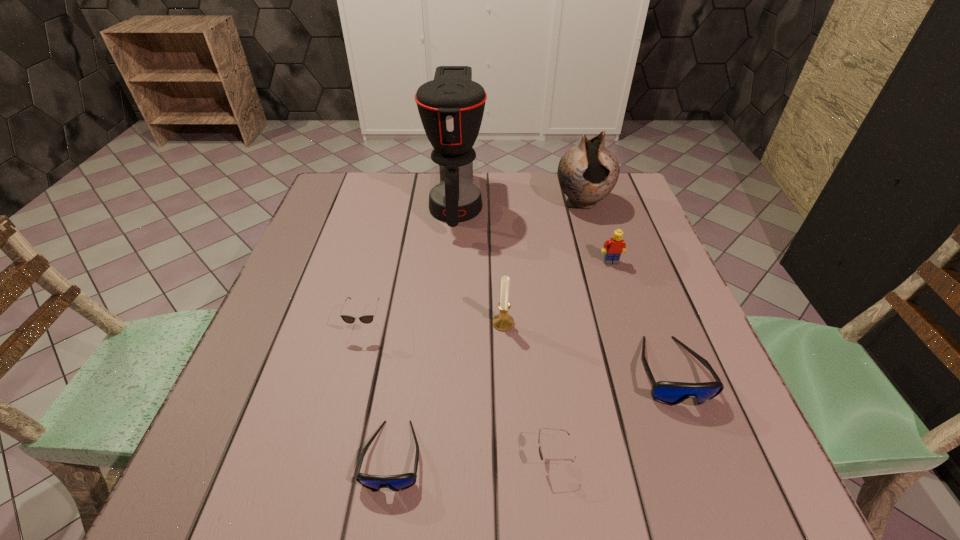
Where is `coffee maker`? This screenshot has height=540, width=960. coffee maker is located at coordinates click(451, 107).

You are a GUI agent. You are given a task and a screenshot of the screen. Output one action in this format:
    pyautogui.click(x=<x>, y=<y>)
    Task: Click on the pottery
    The width and height of the screenshot is (960, 540).
    Given the screenshot: What is the action you would take?
    pyautogui.click(x=587, y=173)

Where is `the third tallest object`? Image resolution: width=960 pixels, height=540 pixels. the third tallest object is located at coordinates (503, 321).

The width and height of the screenshot is (960, 540). I want to click on the fourth object from left to right, so click(503, 321).

This screenshot has width=960, height=540. Identify the location of the third farthest object. (615, 246).

In order to click on Lego in this screenshot , I will do `click(615, 246)`.

This screenshot has width=960, height=540. I want to click on the farther black sunglasses, so click(x=366, y=319).

The height and width of the screenshot is (540, 960). Find the location of `the left black sunglasses`. the left black sunglasses is located at coordinates (366, 319).

Identify the location of the right blue sunglasses. (671, 393).

Identify the location of the rightmost sunglasses. This screenshot has height=540, width=960. (671, 393).